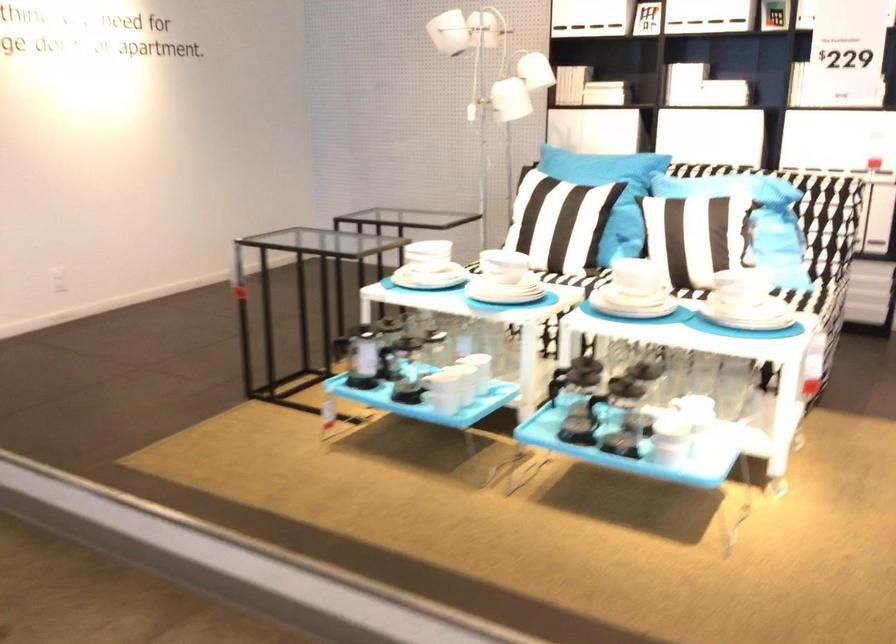
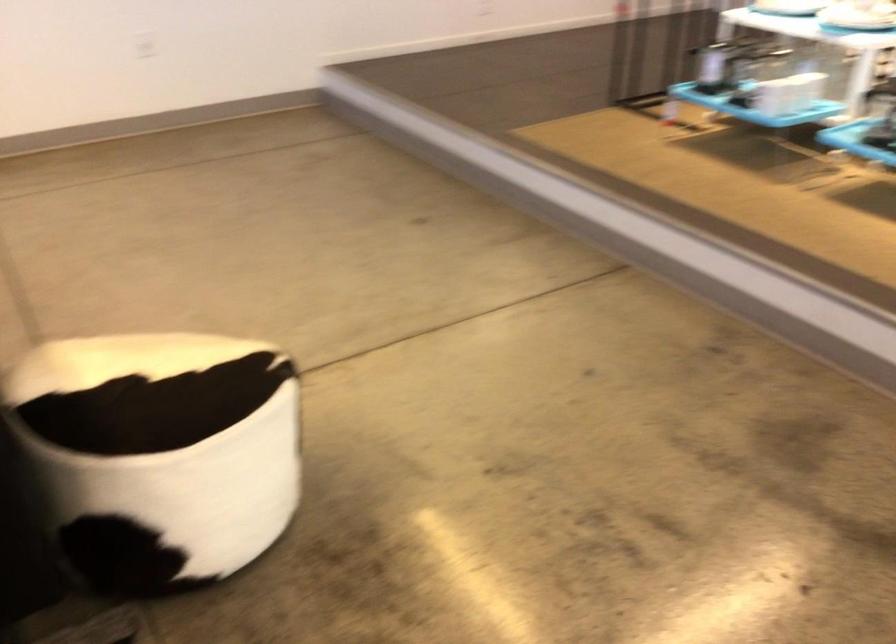
How did the camera likely rotate?

The camera's rotation is toward left-down.